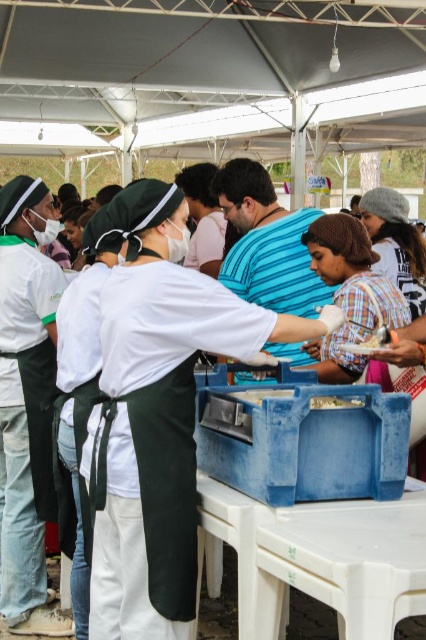
Looking at this image, is white fabric mask at left taller than blue striped shirt at center?

Indeed, white fabric mask at left has a greater height compared to blue striped shirt at center.

Does white fabric mask at left appear over blue striped shirt at center?

No.

Measure the distance between white fabric mask at left and camera.

They are 10.94 feet apart.

You are a GUI agent. You are given a task and a screenshot of the screen. Output one action in this format:
    pyautogui.click(x=<x>, y=<y>)
    Task: Click on the white fabric mask at left
    This screenshot has width=426, height=640.
    Given the screenshot: What is the action you would take?
    pyautogui.click(x=26, y=404)

Is blue striped shirt at center in front of smooth plastic container at center?

No.

Which is behind, point (276, 348) or point (322, 397)?

Positioned behind is point (276, 348).

Identify the location of blue striped shirt at center. (267, 243).

Is point (9, 508) more distant than point (314, 397)?

Yes, it is behind point (314, 397).

Who is more distant from viewer, (51,476) or (325,403)?

Positioned behind is point (51,476).

Identify the location of white fabric mask at left. Image resolution: width=426 pixels, height=640 pixels. (26, 404).